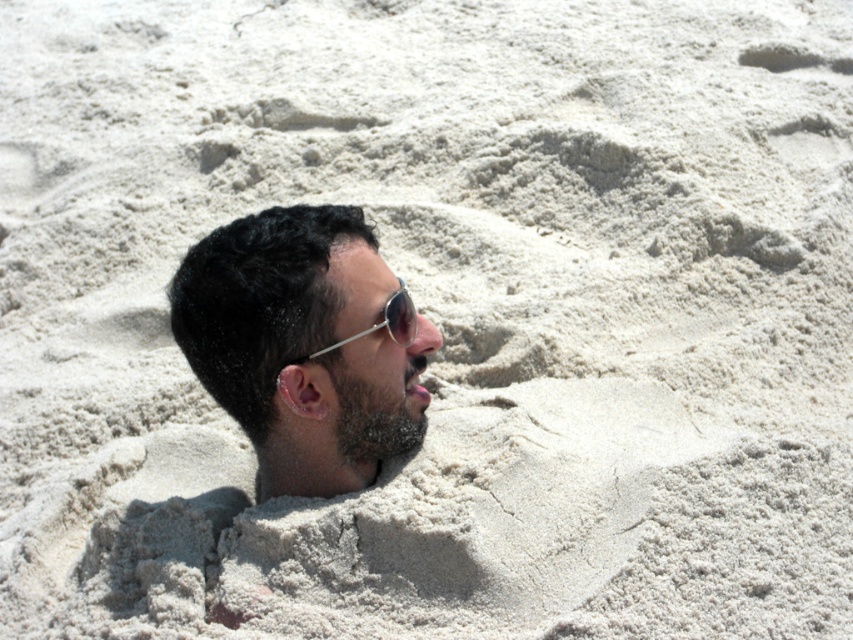
Can you confirm if dark brown hair at center is wider than metallic reflective sunglasses at center?

Correct, the width of dark brown hair at center exceeds that of metallic reflective sunglasses at center.

Does dark brown hair at center have a lesser height compared to metallic reflective sunglasses at center?

In fact, dark brown hair at center may be taller than metallic reflective sunglasses at center.

Does point (363, 252) lie in front of point (358, 332)?

No, (363, 252) is behind (358, 332).

Find the location of a particular element. Image resolution: width=853 pixels, height=640 pixels. dark brown hair at center is located at coordinates (302, 346).